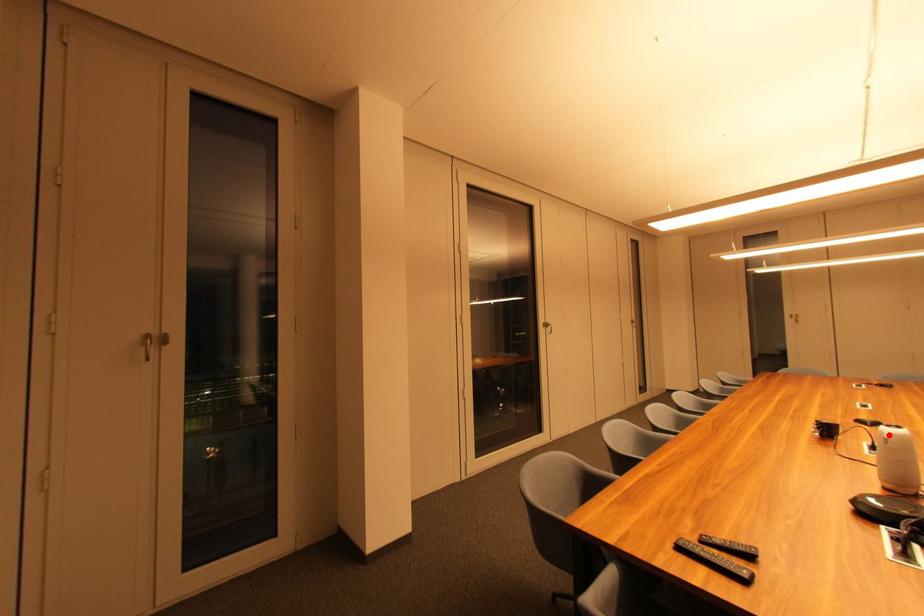
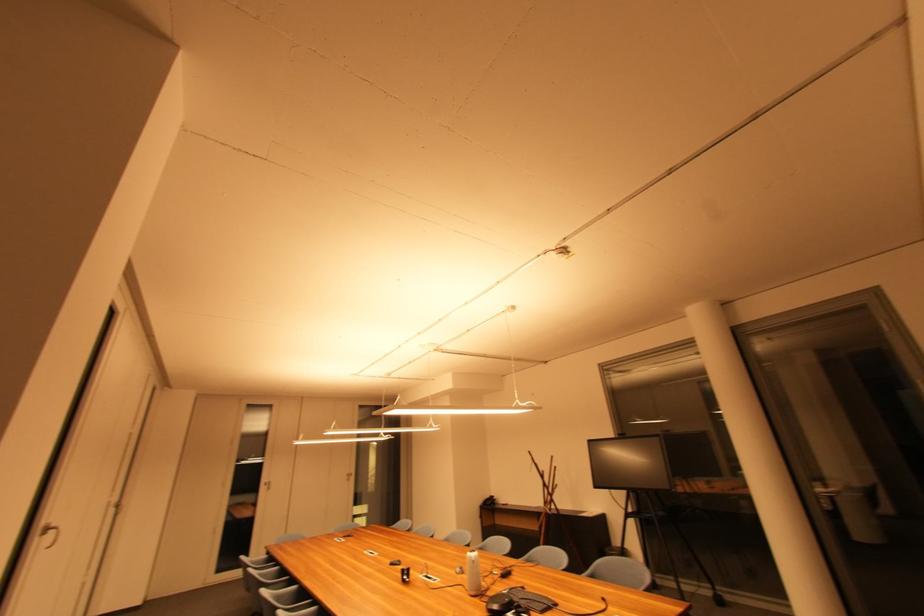
Locate, in the second image, the point that corresponds to the highlighted location in the first image.

(477, 560)